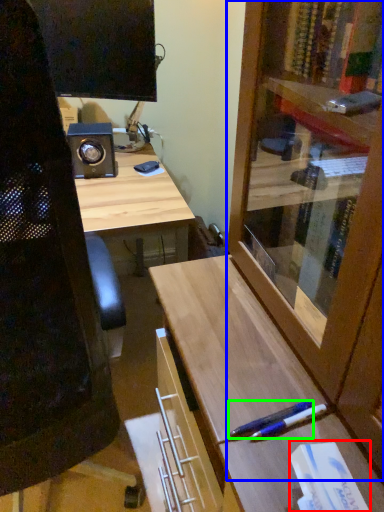
Question: Which object is the closest to the book (highlighted by a red box)? Choose among these: cabinetry (highlighted by a blue box) or pen (highlighted by a green box).

Choices:
 (A) cabinetry
 (B) pen

Answer: (B)